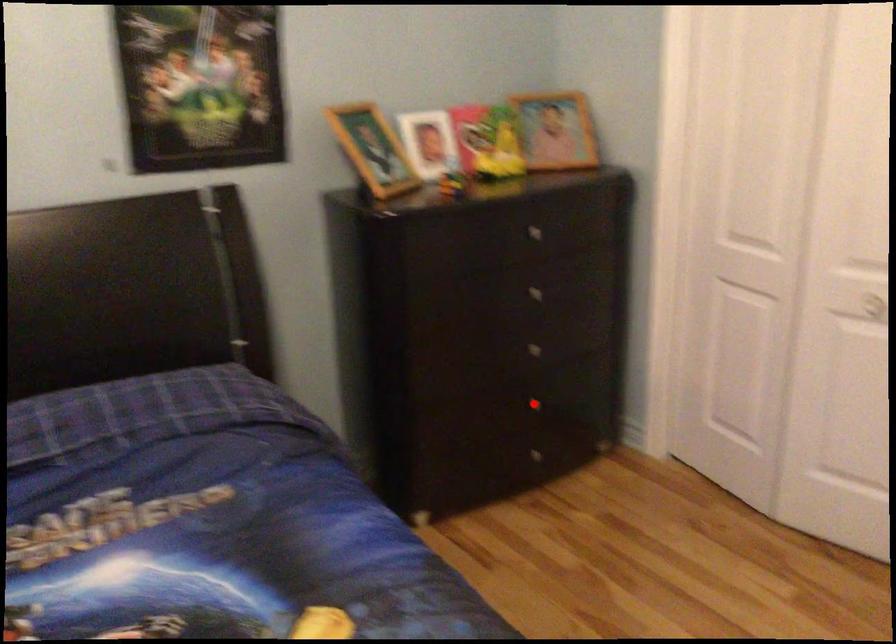
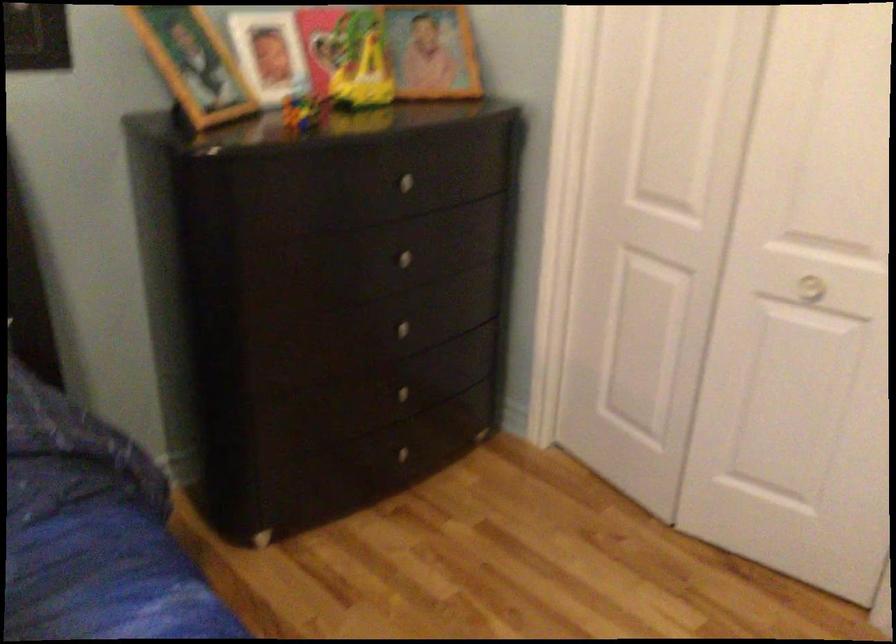
Question: I am providing you with two images of the same scene from different viewpoints. Image1 has a red point marked. In image2, the corresponding 3D location appears at what relative position? Reply with the corresponding letter.

Choices:
 (A) Closer
 (B) Farther

Answer: (A)